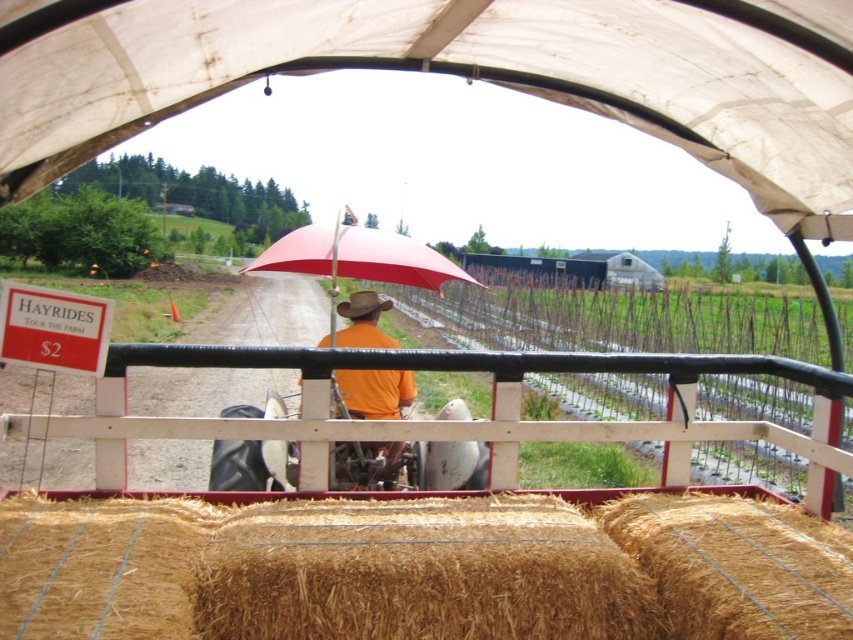
You are standing inside the covered wagon and want to know where the golden straw bales at lower center are positioned relative to the tractor driver. Can you determine their location based on the coordinates provided?

The golden straw bales at lower center are located at coordinates point [421,570], which places them in the lower central area of the wagon, near the tractor driver.

You are a visitor sitting inside the wagon and want to reach the red matte umbrella at center to ask the driver a question. The white fabric canopy at upper center is in the way. What is the minimum distance you must move around the canopy to reach the umbrella?

The white fabric canopy at upper center is 1.98 meters from the red matte umbrella at center. To reach the umbrella, you must move around the canopy, so the minimum distance you must move is approximately 1.98 meters.